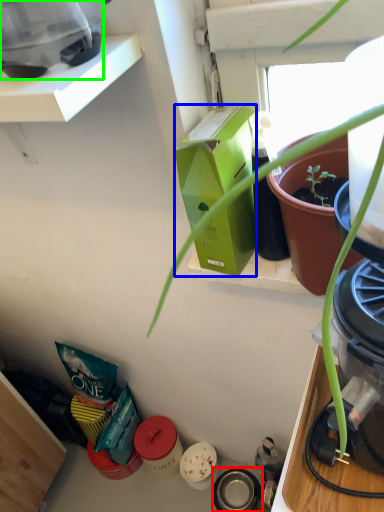
Question: Which object is the farthest from appliance (highlighted by a red box)? Choose among these: box (highlighted by a blue box) or appliance (highlighted by a green box).

Choices:
 (A) box
 (B) appliance

Answer: (B)